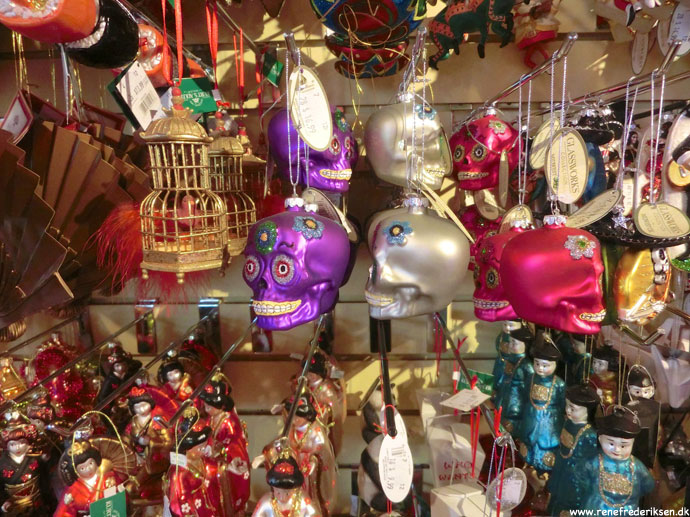
What are the coordinates of `metal hooks for hanging items` in the screenshot? It's located at (380, 344), (303, 368), (234, 343), (128, 383), (81, 358), (510, 89).